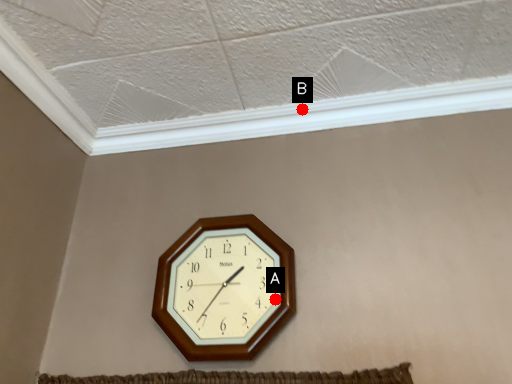
Question: Two points are circled on the image, labeled by A and B beside each circle. Which point is farther from the camera taking this photo?

Choices:
 (A) A is further
 (B) B is further

Answer: (B)